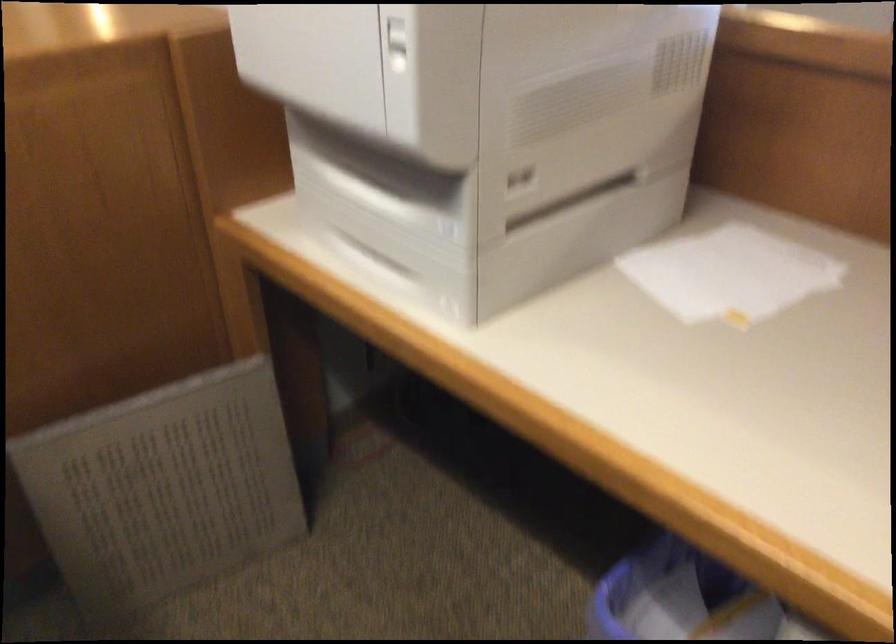
This screenshot has height=644, width=896. What are the coordinates of `stack of paper` in the screenshot? It's located at (736, 275).